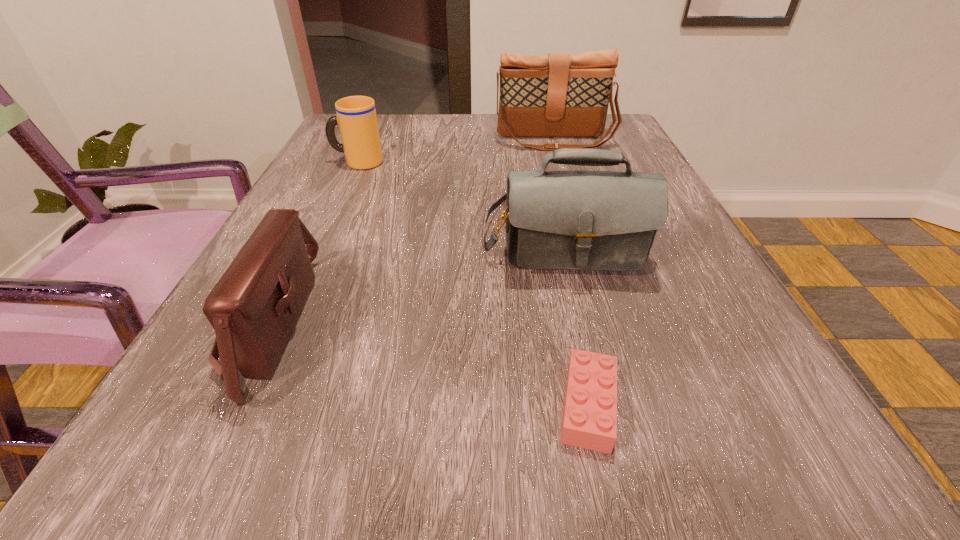
Image resolution: width=960 pixels, height=540 pixels. In order to click on cup present at the left edge in this screenshot , I will do `click(356, 116)`.

Locate an element on the screen. object present at the far right corner is located at coordinates (557, 95).

What are the coordinates of `free region at the far edge of the desktop` in the screenshot? It's located at (426, 143).

Where is `free space at the near edge`? The height and width of the screenshot is (540, 960). free space at the near edge is located at coordinates (420, 454).

Identify the location of blank space at the left edge of the desktop. This screenshot has width=960, height=540. (274, 392).

In the image, there is a desktop. Identify the location of vacant space at the right edge. (758, 420).

This screenshot has height=540, width=960. I want to click on vacant space at the near left corner of the desktop, so click(177, 507).

Identify the location of vacant area at the near right corner of the desktop. (741, 454).

Locate an element on the screen. This screenshot has height=540, width=960. vacant space in between the Lego and the second farthest object is located at coordinates (472, 284).

Find the location of `vacant area that lies between the farthest shoulder bag and the leftmost shoulder bag`. vacant area that lies between the farthest shoulder bag and the leftmost shoulder bag is located at coordinates click(412, 233).